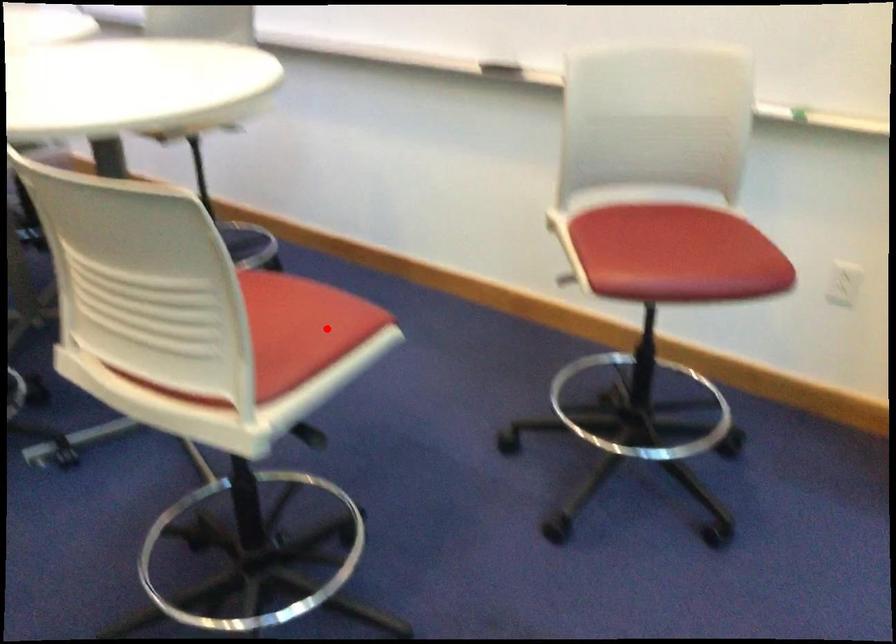
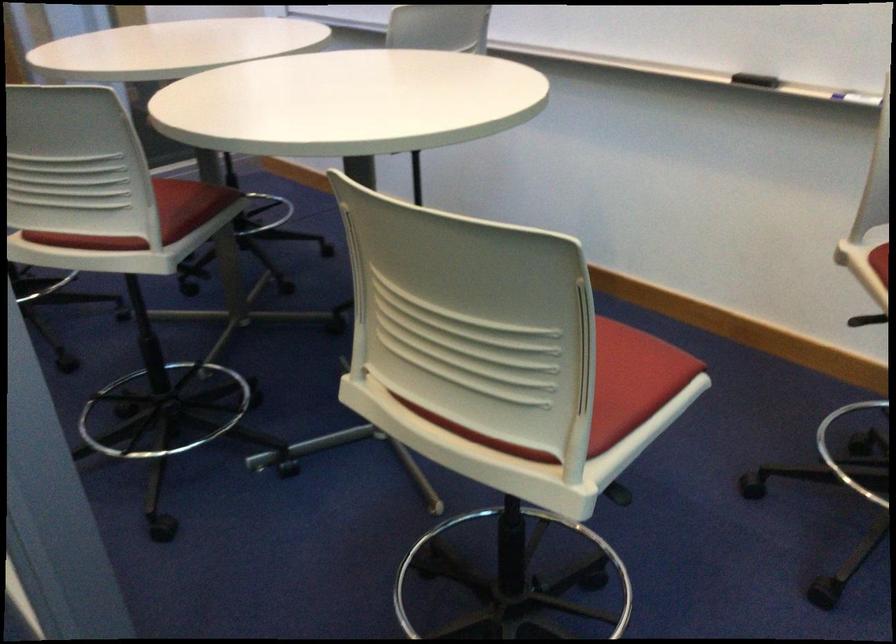
In the second image, find the point that corresponds to the highlighted location in the first image.

(633, 380)